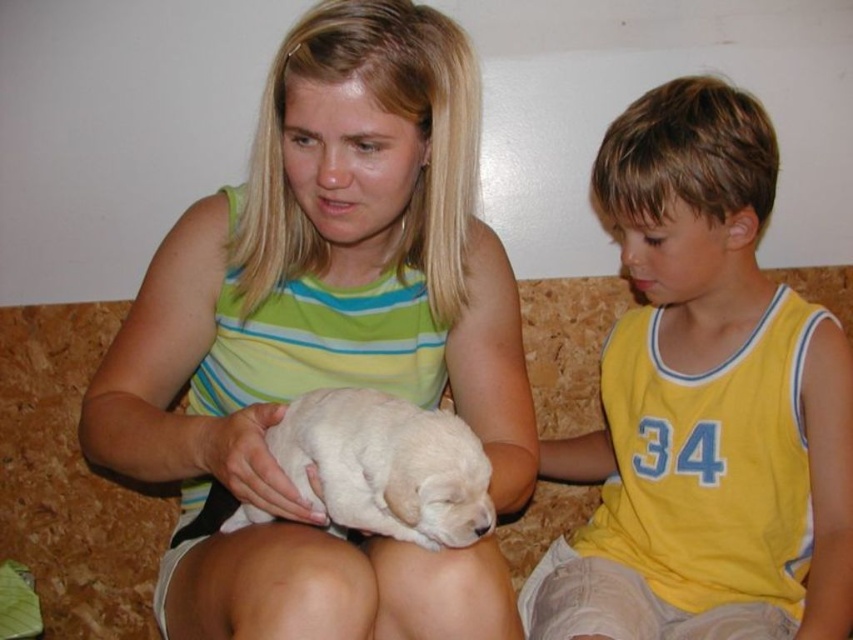
Question: Is yellow jersey at right to the right of white fur puppy at center from the viewer's perspective?

Choices:
 (A) yes
 (B) no

Answer: (A)

Question: Which object appears farthest from the camera in this image?

Choices:
 (A) white soft fur at center
 (B) yellow jersey at right

Answer: (B)

Question: Which point appears closest to the camera in this image?

Choices:
 (A) (773, 342)
 (B) (339, 518)

Answer: (B)

Question: Is white soft fur at center above white fur puppy at center?

Choices:
 (A) no
 (B) yes

Answer: (B)

Question: Can you confirm if yellow jersey at right is positioned above white fur puppy at center?

Choices:
 (A) yes
 (B) no

Answer: (A)

Question: Which of these objects is positioned farthest from the yellow jersey at right?

Choices:
 (A) white soft fur at center
 (B) white fur puppy at center

Answer: (B)